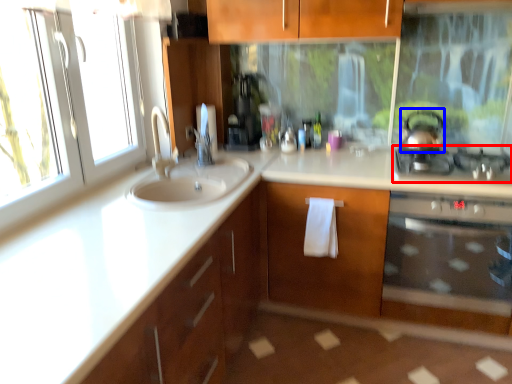
Question: Which object is further to the camera taking this photo, gas stove (highlighted by a red box) or tea pot (highlighted by a blue box)?

Choices:
 (A) gas stove
 (B) tea pot

Answer: (B)